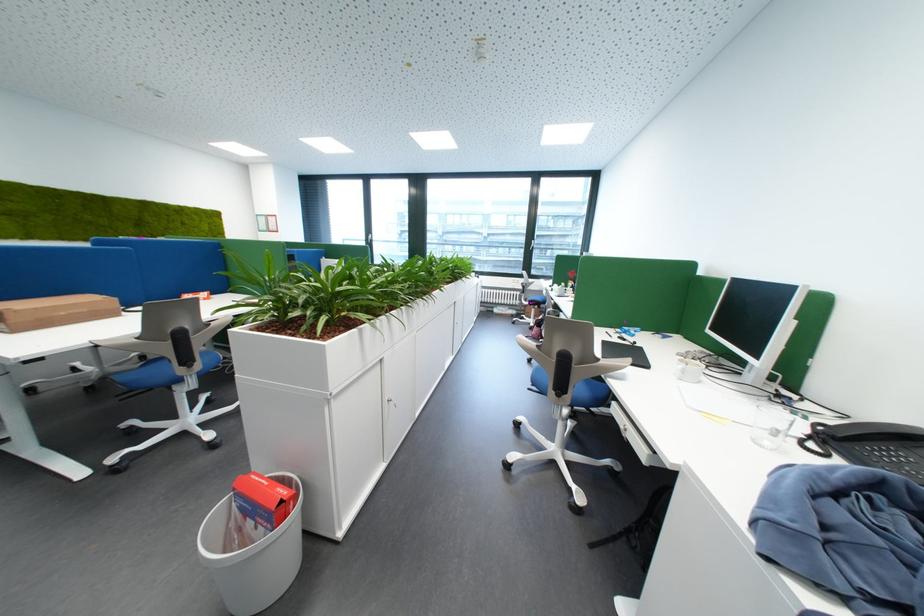
Image resolution: width=924 pixels, height=616 pixels. Describe the element at coordinates (624, 431) in the screenshot. I see `the white desk drawer` at that location.